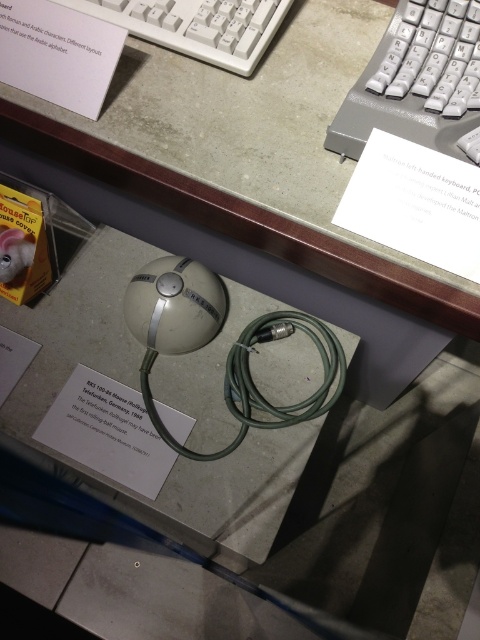
Can you confirm if gray plastic keyboard at upper right is taller than white plastic keyboard at upper center?

Yes, gray plastic keyboard at upper right is taller than white plastic keyboard at upper center.

This screenshot has width=480, height=640. I want to click on gray plastic keyboard at upper right, so click(418, 81).

Between gray plastic keyboard at upper right and white matte sphere at center, which one appears on the right side from the viewer's perspective?

Positioned to the right is gray plastic keyboard at upper right.

Is gray plastic keyboard at upper right to the left of white matte sphere at center from the viewer's perspective?

In fact, gray plastic keyboard at upper right is to the right of white matte sphere at center.

Is point (363, 88) behind point (169, 339)?

No, it is not.

This screenshot has height=640, width=480. In order to click on gray plastic keyboard at upper right in this screenshot , I will do `click(418, 81)`.

Between point (199, 58) and point (225, 392), which one is positioned in front?

Point (225, 392) is in front.

Can you confirm if white plastic keyboard at upper center is positioned below green rubber cable at center?

Actually, white plastic keyboard at upper center is above green rubber cable at center.

Does point (132, 17) come closer to viewer compared to point (322, 324)?

Yes, it is.

Where is `white plastic keyboard at upper center`? The height and width of the screenshot is (640, 480). white plastic keyboard at upper center is located at coordinates (196, 26).